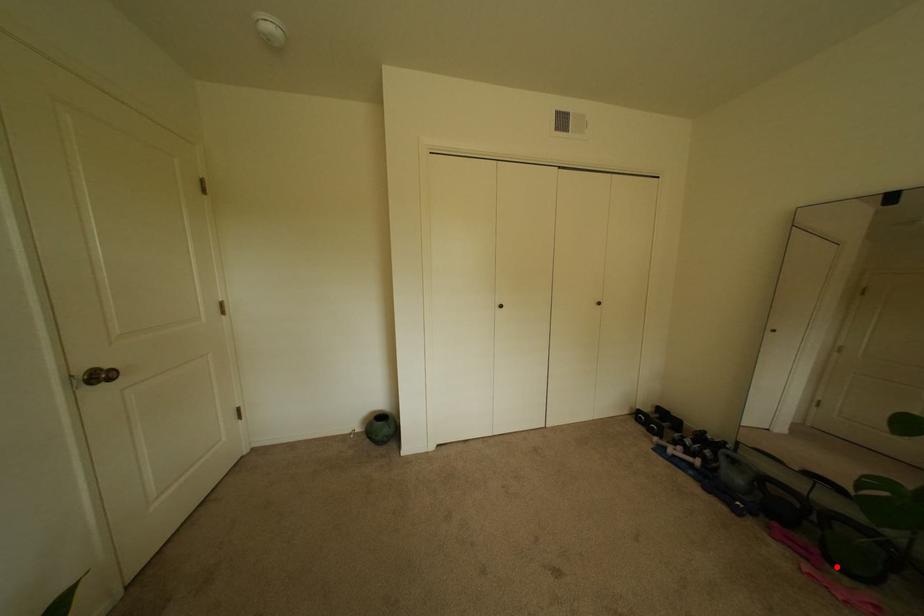
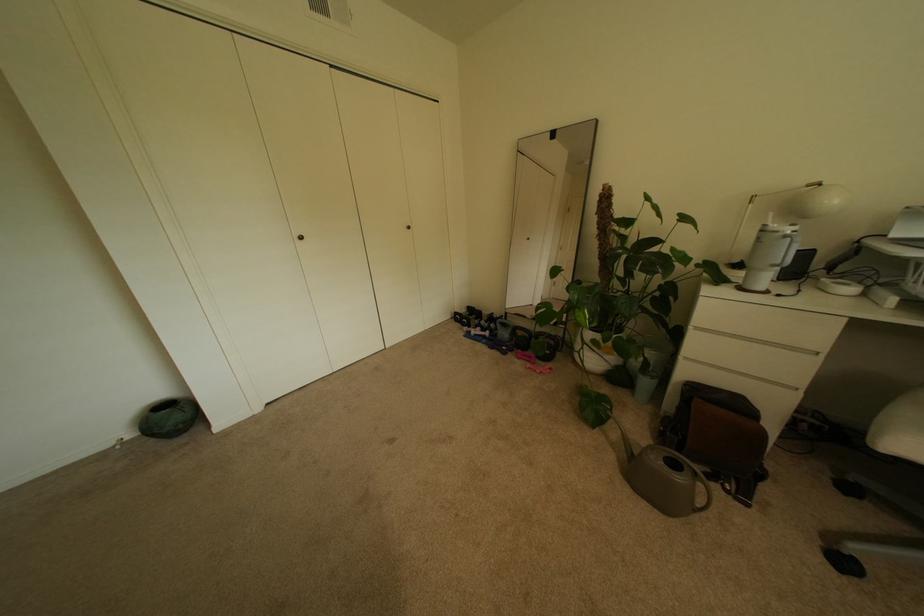
The point at the highlighted location is marked in the first image. Where is the corresponding point in the second image?

(545, 362)